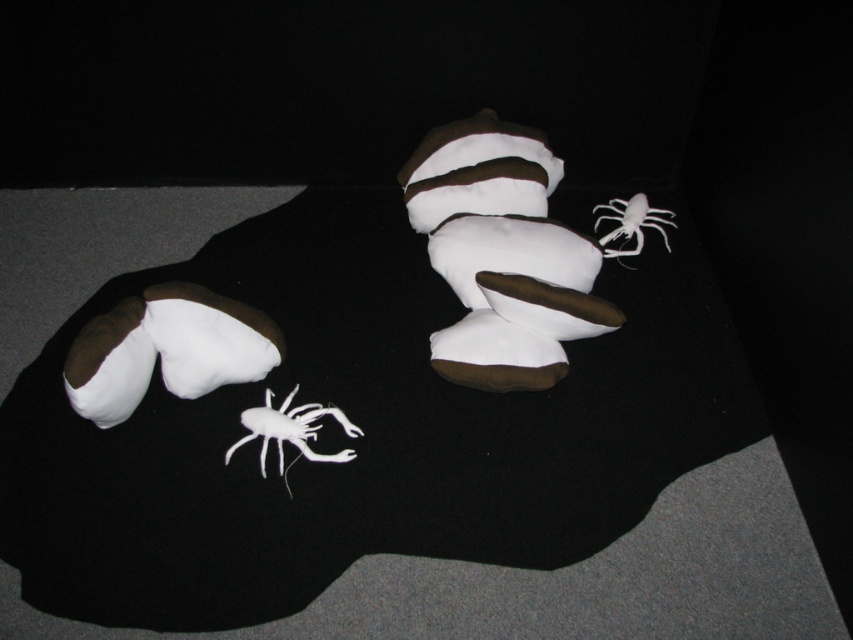
Question: Which object is farther from the camera taking this photo?

Choices:
 (A) white matte spider at lower center
 (B) white matte spider at upper right

Answer: (B)

Question: Does white matte spider at lower center appear on the right side of white matte spider at upper right?

Choices:
 (A) no
 (B) yes

Answer: (A)

Question: Which object is farther from the camera taking this photo?

Choices:
 (A) white matte spider at upper right
 (B) white matte spider at lower center

Answer: (A)

Question: Is white matte spider at lower center closer to the viewer compared to white matte spider at upper right?

Choices:
 (A) no
 (B) yes

Answer: (B)

Question: Does white matte spider at lower center appear over white matte spider at upper right?

Choices:
 (A) yes
 (B) no

Answer: (B)

Question: Among these points, which one is nearest to the camera?

Choices:
 (A) (619, 228)
 (B) (329, 454)

Answer: (B)